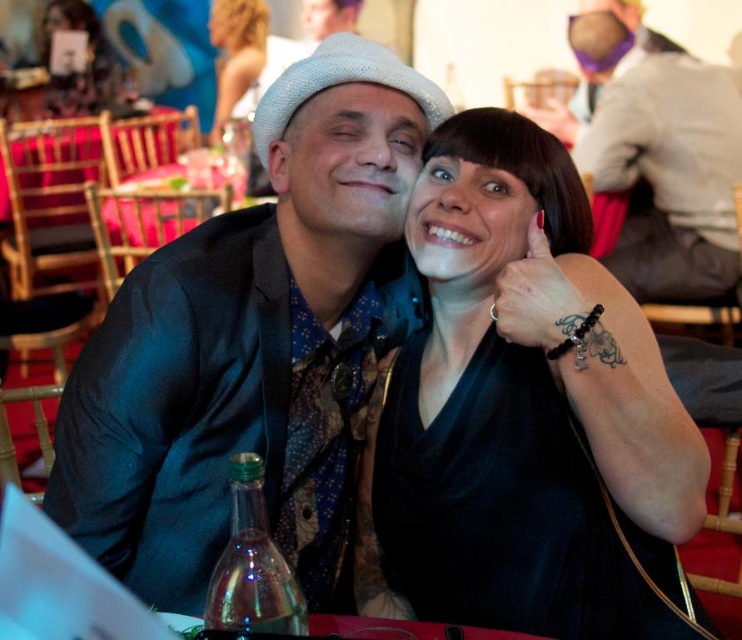
Which is more to the left, black matte dress at center or matte black jacket at upper center?

Positioned to the left is black matte dress at center.

Between black matte dress at center and matte black jacket at upper center, which one has less height?

With less height is black matte dress at center.

Where is `black matte dress at center`? This screenshot has width=742, height=640. black matte dress at center is located at coordinates (528, 410).

Is point (355, 100) farther from viewer compared to point (623, 172)?

No.

Measure the distance between satin black suit at center and camera.

A distance of 3.72 feet exists between satin black suit at center and camera.

This screenshot has height=640, width=742. What do you see at coordinates (255, 344) in the screenshot?
I see `satin black suit at center` at bounding box center [255, 344].

Where is `satin black suit at center`? satin black suit at center is located at coordinates (255, 344).

Who is higher up, satin black suit at center or black matte dress at center?

satin black suit at center

This screenshot has height=640, width=742. Identify the location of satin black suit at center. (255, 344).

Find the location of a particular element. This screenshot has width=742, height=640. satin black suit at center is located at coordinates (255, 344).

Locate an element on the screen. satin black suit at center is located at coordinates (255, 344).